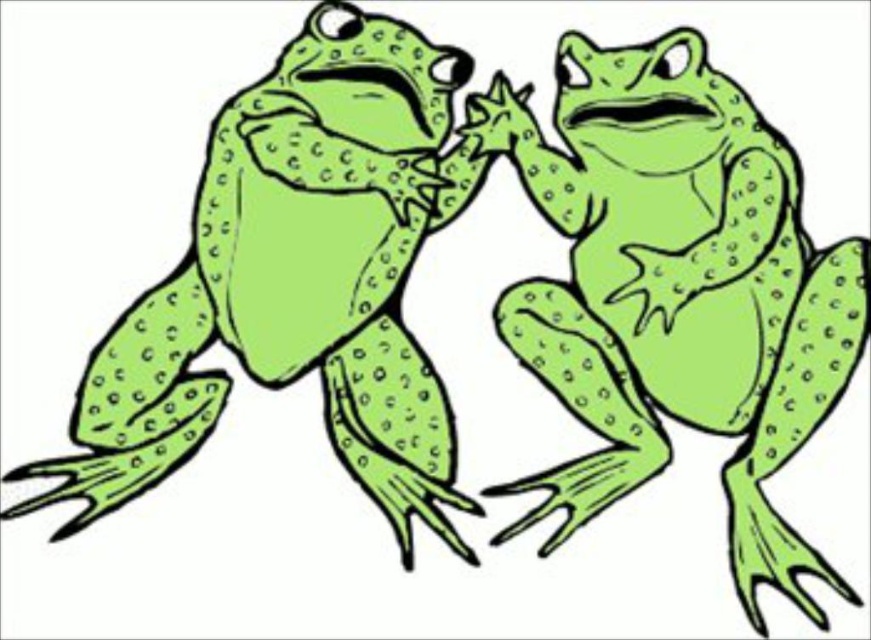
In the scene shown: Between green matte/skinny frog at right and green dotted frog at left, which one is positioned lower?

Positioned lower is green matte/skinny frog at right.

Based on the photo, does green matte/skinny frog at right appear on the right side of green dotted frog at left?

Indeed, green matte/skinny frog at right is positioned on the right side of green dotted frog at left.

Which is behind, point (676, 108) or point (112, 362)?

Point (676, 108)

Find the location of `green matte/skinny frog at right`. green matte/skinny frog at right is located at coordinates (677, 292).